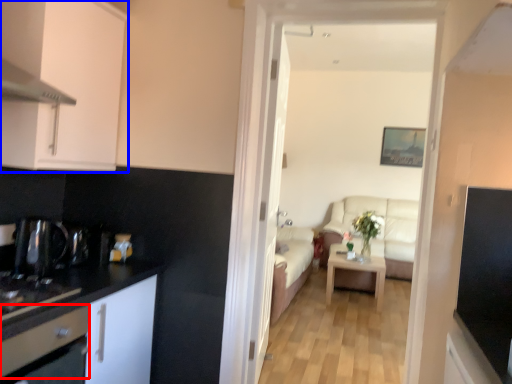
Question: Which of the following is the farthest to the observer, drawer (highlighted by a red box) or cabinetry (highlighted by a blue box)?

Choices:
 (A) drawer
 (B) cabinetry

Answer: (B)